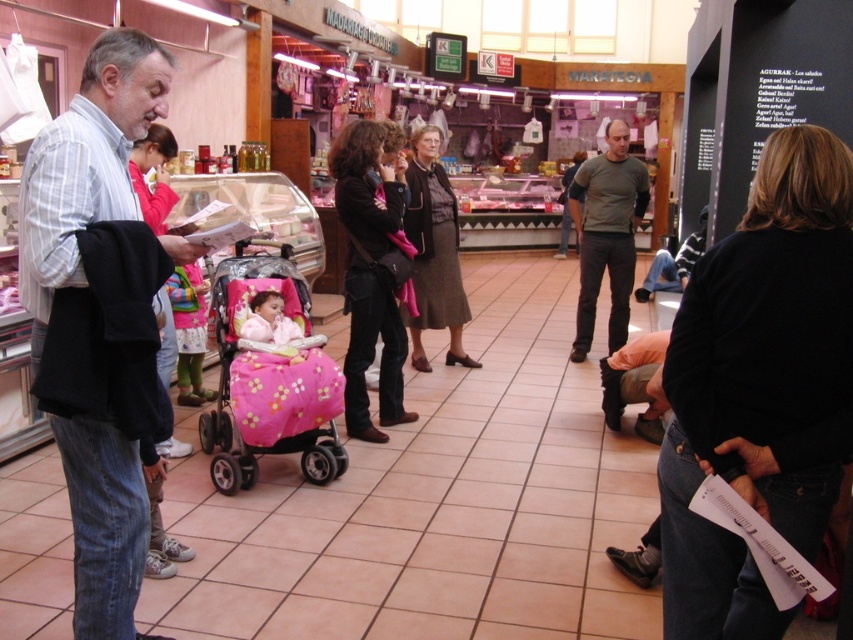
Question: Among these points, which one is nearest to the camera?

Choices:
 (A) 463,305
 (B) 567,228
 (C) 634,172
 (D) 264,282

Answer: (D)

Question: Is pink fabric baby carriage at center to the left of black leather jacket at center from the viewer's perspective?

Choices:
 (A) no
 (B) yes

Answer: (B)

Question: Which point is closer to the camera taking this photo?

Choices:
 (A) pyautogui.click(x=821, y=477)
 (B) pyautogui.click(x=612, y=244)
 (C) pyautogui.click(x=432, y=289)

Answer: (A)

Question: Among these objects, which one is nearest to the camera?

Choices:
 (A) pink fabric baby carriage at center
 (B) matte gray sweater at center
 (C) brown fabric skirt at center
 (D) pink plush baby carriage at center

Answer: (A)

Question: Is light blue striped shirt at left bigger than pink plush baby carriage at center?

Choices:
 (A) yes
 (B) no

Answer: (A)

Question: Is pink fabric baby carriage at center to the right of pink plush baby carriage at center from the viewer's perspective?

Choices:
 (A) yes
 (B) no

Answer: (B)